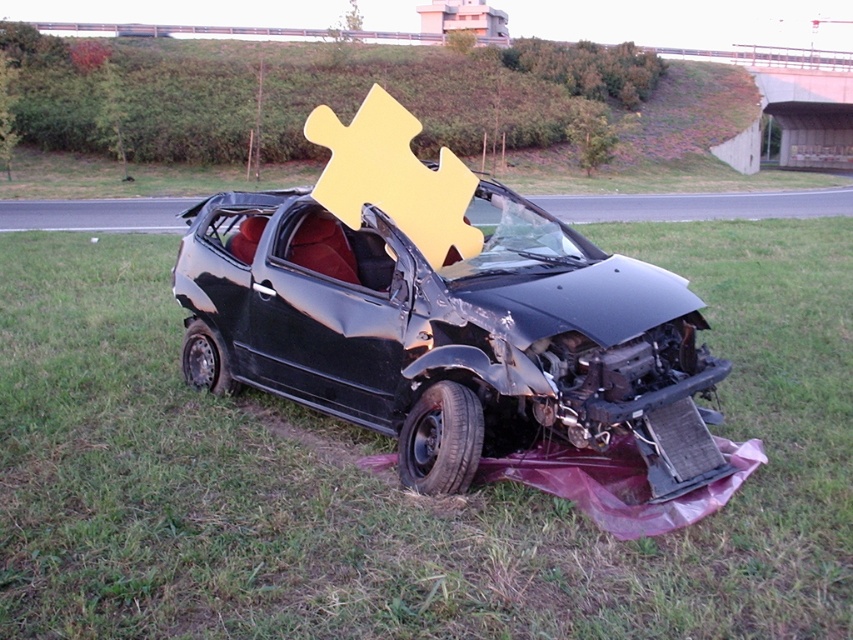
Between green grass at center and black matte car at center, which one is positioned lower?

Positioned lower is green grass at center.

Does green grass at center lie behind black matte car at center?

No.

Which is in front, point (822, 461) or point (656, 435)?

Point (656, 435) is in front.

Locate an element on the screen. This screenshot has height=640, width=853. green grass at center is located at coordinates [393, 474].